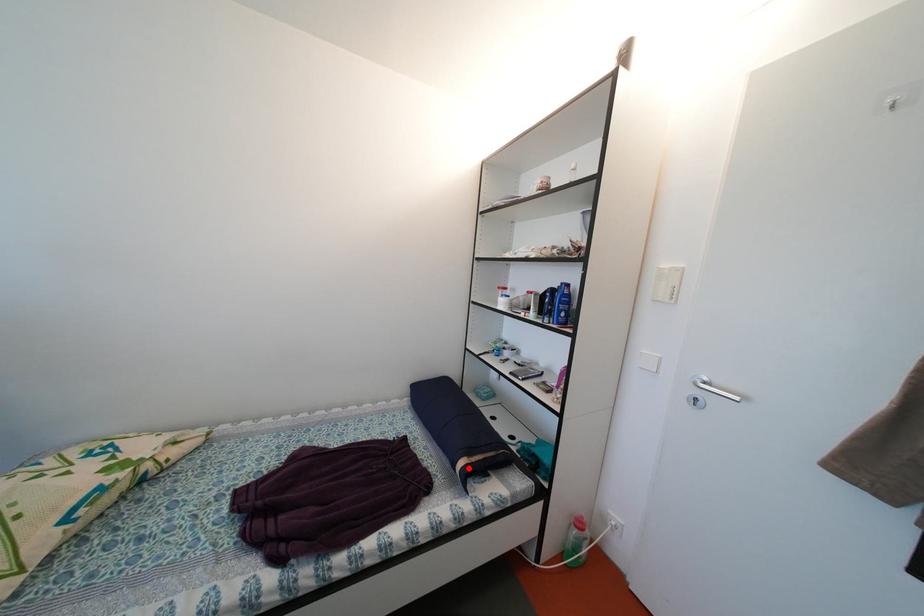
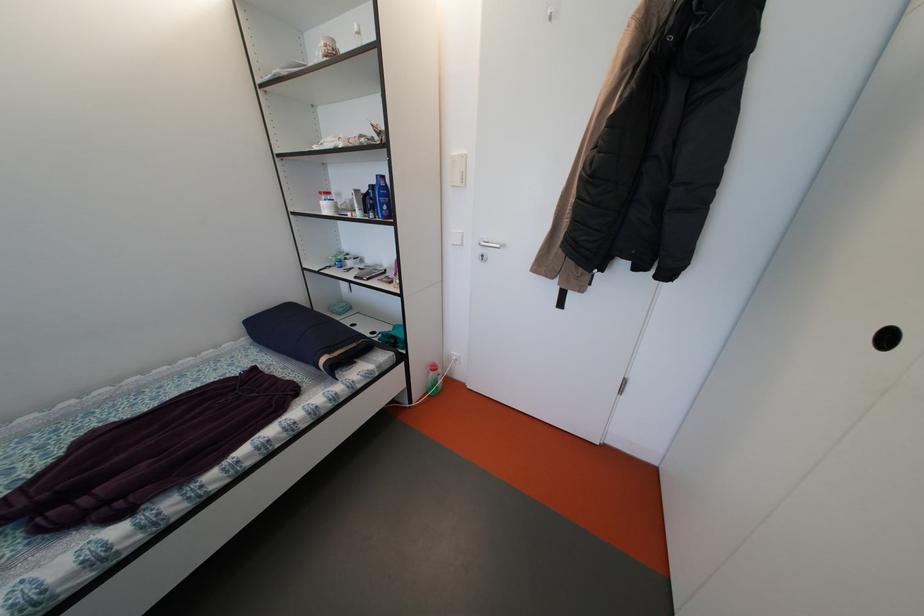
Where in the second image is the point corresponding to the highlighted location from the first image?

(331, 365)